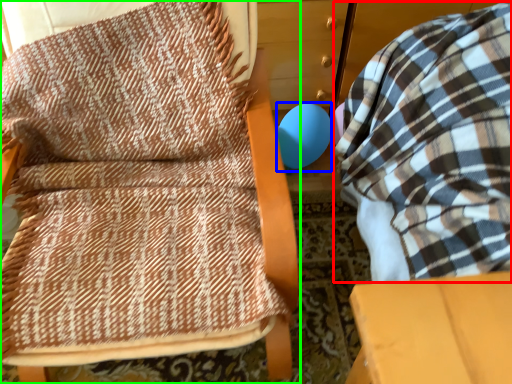
Question: Based on their relative distances, which object is nearer to bean bag chair (highlighted by a red box)? Choose from balloon (highlighted by a blue box) and furniture (highlighted by a green box).

Choices:
 (A) balloon
 (B) furniture

Answer: (B)